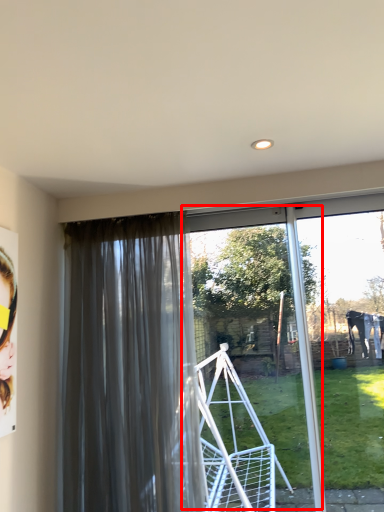
Question: Where is screen door (annotated by the red box) located in relation to curtain in the image?

Choices:
 (A) right
 (B) left

Answer: (A)